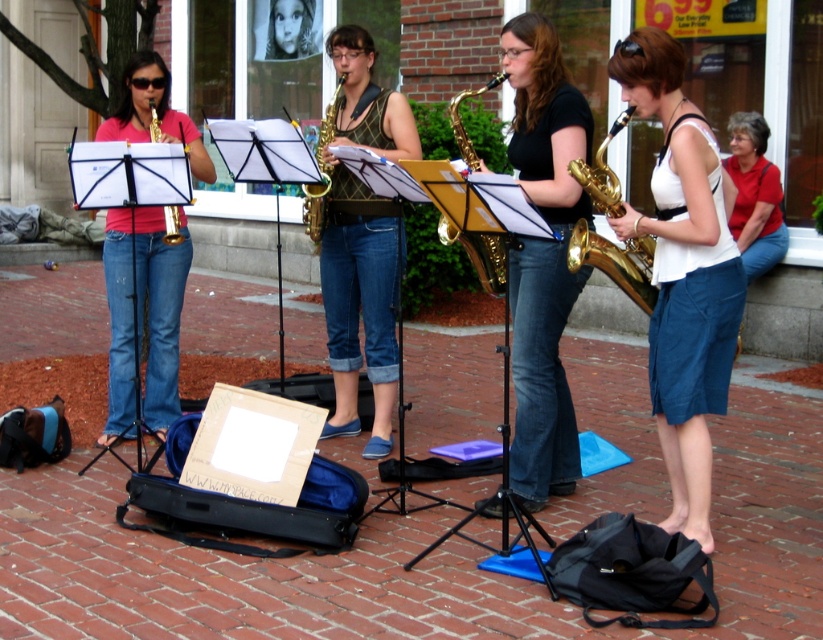
You are a photographer trying to capture the musician wearing the matte white tank top at center and the gold textured saxophone at center in the same frame. Based on their positions, which object should you focus on first to ensure both are in the shot?

You should focus on the gold textured saxophone at center first because the matte white tank top at center is to the right of it, so by centering the saxophone, the tank top will naturally fall into the frame to its right.

You are a photographer taking a picture of the matte white tank top at center and the gold textured saxophone at center. Which object should you focus on first if you want to capture both in sharp focus?

The matte white tank top at center has a smaller size compared to the gold textured saxophone at center, so you should focus on the gold textured saxophone at center first to ensure both are in sharp focus.

You are a street performer who just arrived at the square. You need to set up your gold textured saxophone at center and white cotton shirt at upper right. Since you want to make sure your saxophone is visible to the audience, which object should you place higher?

The gold textured saxophone at center should be placed higher because it is taller than the white cotton shirt at upper right, ensuring it stands out to the audience.